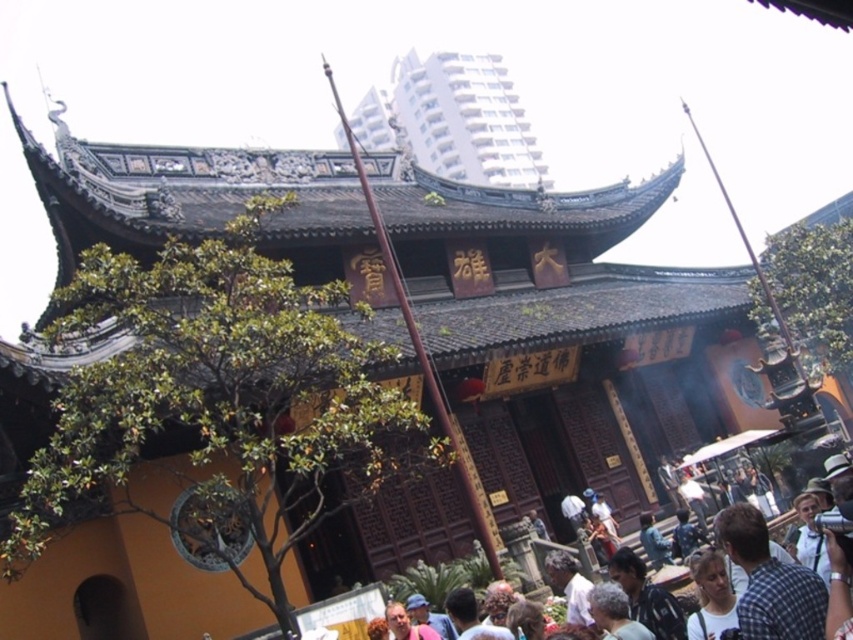
You are standing in front of a traditional Chinese building with a dark gray roof and vibrant yellow walls. You notice a specific point at coordinates (453, 120). What object is located at this point?

The white glossy building at upper center is located at point (453, 120).

You are a photographer standing in front of the traditional Chinese building. You want to capture a photo that includes both the white glossy building at upper center and the light brown hair at lower right. Based on their sizes, which object should you focus on to ensure both fit in the frame?

The white glossy building at upper center is wider than the light brown hair at lower right, so focusing on the building will ensure both objects fit in the frame as it occupies more space.

You are standing in front of the traditional Chinese building and want to take a photo of the white glossy building at upper center and the light brown hair at lower right. Which object should you adjust your camera focus on first to ensure both are in focus?

You should focus on the white glossy building at upper center first because it is closer to you than the light brown hair at lower right, so adjusting focus starting from the closer object ensures both can be in focus.